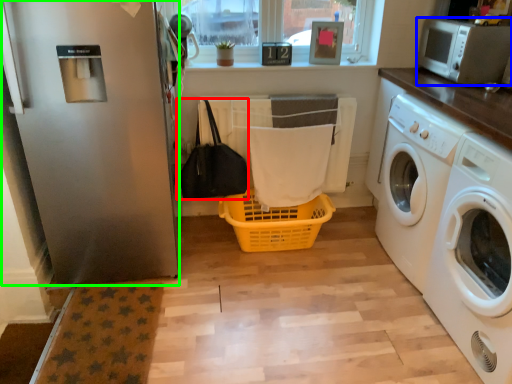
Question: Estimate the real-world distances between objects in this image. Which object is farther from bag (highlighted by a red box), microwave oven (highlighted by a blue box) or screen door (highlighted by a green box)?

Choices:
 (A) microwave oven
 (B) screen door

Answer: (A)